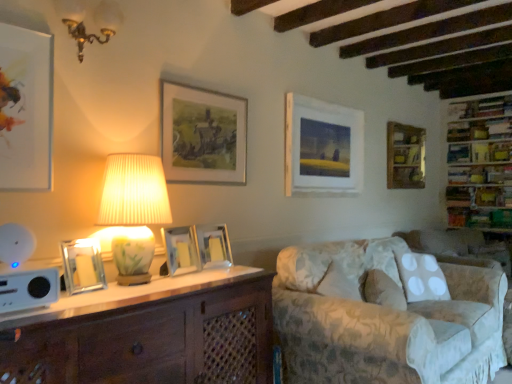
Question: Is matte white picture frame at upper left, which is the 7th picture frame in right-to-left order, oriented towards fluffy white pillow at lower right?

Choices:
 (A) no
 (B) yes

Answer: (A)

Question: Is matte white picture frame at upper left, arranged as the first picture frame when viewed from the left, thinner than fluffy white pillow at lower right?

Choices:
 (A) yes
 (B) no

Answer: (A)

Question: Is matte white picture frame at upper left, which is counted as the seventh picture frame, starting from the back, to the right of fluffy white pillow at lower right from the viewer's perspective?

Choices:
 (A) yes
 (B) no

Answer: (B)

Question: Considering the relative sizes of matte white picture frame at upper left, which is the 1th picture frame from front to back, and fluffy white pillow at lower right in the image provided, is matte white picture frame at upper left, which is the 1th picture frame from front to back, taller than fluffy white pillow at lower right?

Choices:
 (A) yes
 (B) no

Answer: (A)

Question: From a real-world perspective, is matte white picture frame at upper left, arranged as the first picture frame when viewed from the left, located beneath fluffy white pillow at lower right?

Choices:
 (A) no
 (B) yes

Answer: (A)

Question: Is fluffy white pillow at lower right wider or thinner than white pleated fabric lampshade at upper left, which is counted as the first lamp, starting from the bottom?

Choices:
 (A) thin
 (B) wide

Answer: (A)

Question: Does point (372, 294) appear closer or farther from the camera than point (167, 205)?

Choices:
 (A) farther
 (B) closer

Answer: (A)

Question: Would you say fluffy white pillow at lower right is inside or outside white pleated fabric lampshade at upper left, which appears as the 2th lamp when viewed from the top?

Choices:
 (A) outside
 (B) inside

Answer: (A)

Question: Would you say fluffy white pillow at lower right is to the left or to the right of white pleated fabric lampshade at upper left, which is counted as the first lamp, starting from the bottom, in the picture?

Choices:
 (A) left
 (B) right

Answer: (B)

Question: Is transparent glass picture frame at left, which is counted as the 6th picture frame, starting from the back, spatially inside wooden picture frame at upper right, the 7th picture frame viewed from the left, or outside of it?

Choices:
 (A) inside
 (B) outside

Answer: (B)

Question: From a real-world perspective, is transparent glass picture frame at left, which is counted as the 2th picture frame, starting from the left, positioned above or below wooden picture frame at upper right, placed as the 7th picture frame when sorted from front to back?

Choices:
 (A) below
 (B) above

Answer: (A)

Question: From the image's perspective, is transparent glass picture frame at left, which is counted as the 6th picture frame, starting from the back, above or below wooden picture frame at upper right, placed as the 7th picture frame when sorted from front to back?

Choices:
 (A) above
 (B) below

Answer: (B)

Question: In the image, is transparent glass picture frame at left, positioned as the 6th picture frame in right-to-left order, positioned in front of or behind wooden picture frame at upper right, the 7th picture frame viewed from the left?

Choices:
 (A) behind
 (B) front

Answer: (B)

Question: Is point (466, 153) positioned closer to the camera than point (31, 163)?

Choices:
 (A) closer
 (B) farther

Answer: (B)

Question: Is wooden bookshelf at upper right, which is the 2th shelf from bottom to top, taller or shorter than matte white picture frame at upper left, which is the 1th picture frame from front to back?

Choices:
 (A) tall
 (B) short

Answer: (B)